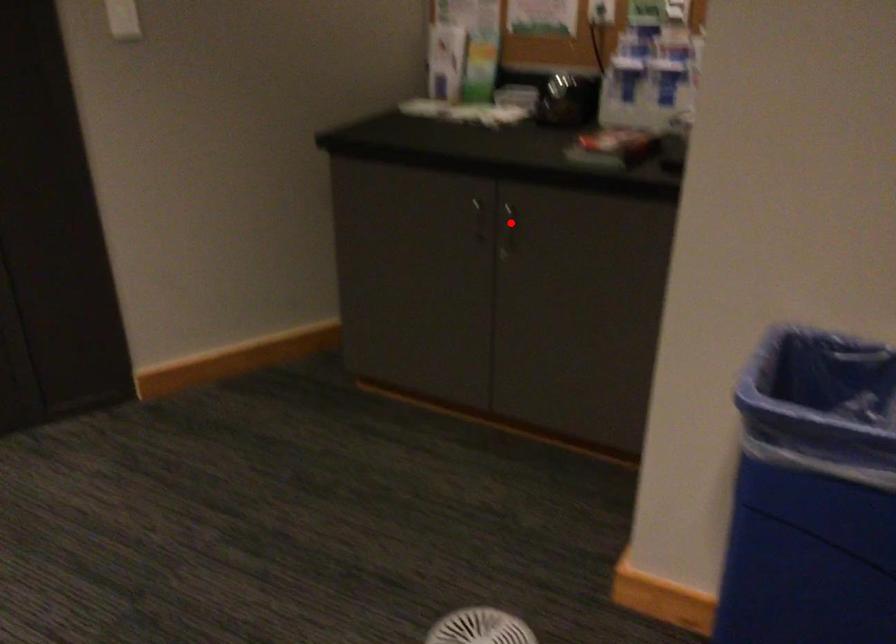
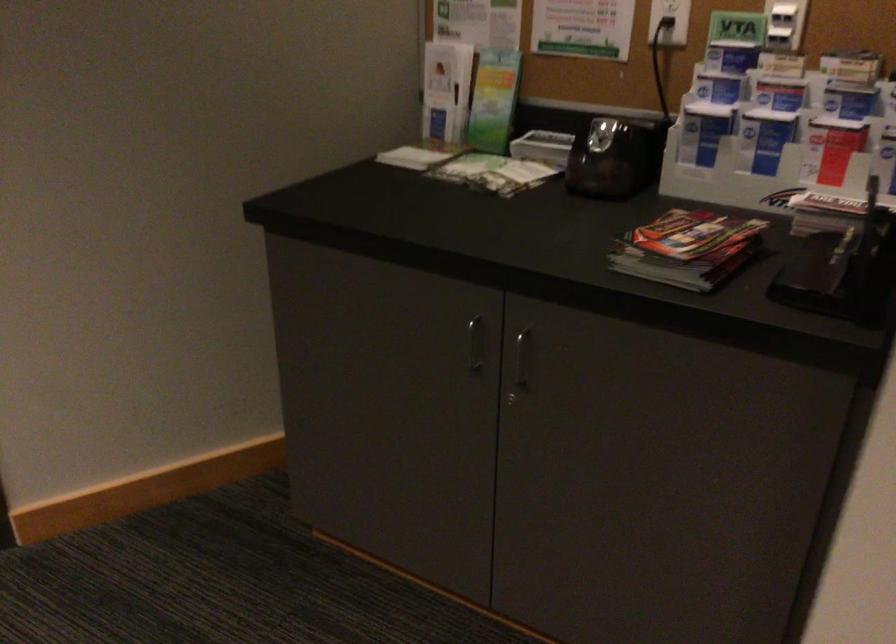
Question: A red point is marked in image1. In image2, is the corresponding 3D point closer to the camera or farther? Reply with the corresponding letter.

Choices:
 (A) The corresponding 3D point is closer.
 (B) The corresponding 3D point is farther.

Answer: (A)